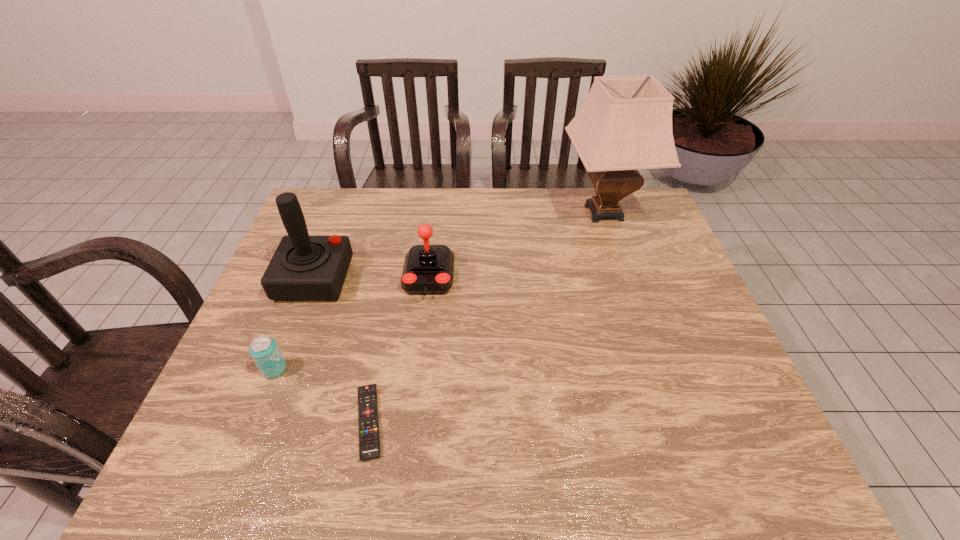
Locate an element on the screen. free space located 0.380m on the left of the lampshade is located at coordinates (446, 212).

Where is `vacant space located on the base of the fourth shortest object`? vacant space located on the base of the fourth shortest object is located at coordinates (380, 279).

The height and width of the screenshot is (540, 960). I want to click on vacant region located on the base of the shorter joystick, so click(x=417, y=376).

This screenshot has width=960, height=540. Identify the location of vacant space located 0.070m on the left of the second shortest object. (232, 369).

Where is `free space located on the right of the nearest object`? The width and height of the screenshot is (960, 540). free space located on the right of the nearest object is located at coordinates (420, 422).

You are a GUI agent. You are given a task and a screenshot of the screen. Output one action in this format:
    pyautogui.click(x=<x>, y=<y>)
    Task: Click on the object located in the far edge section of the desktop
    
    Given the screenshot: What is the action you would take?
    pyautogui.click(x=625, y=124)

I want to click on object present at the near edge, so click(x=369, y=439).

What are the coordinates of `joystick situated at the left edge` in the screenshot? It's located at (303, 268).

Where is `beer can positioned at the left edge`? The width and height of the screenshot is (960, 540). beer can positioned at the left edge is located at coordinates (263, 349).

I want to click on object that is at the right edge, so click(x=625, y=124).